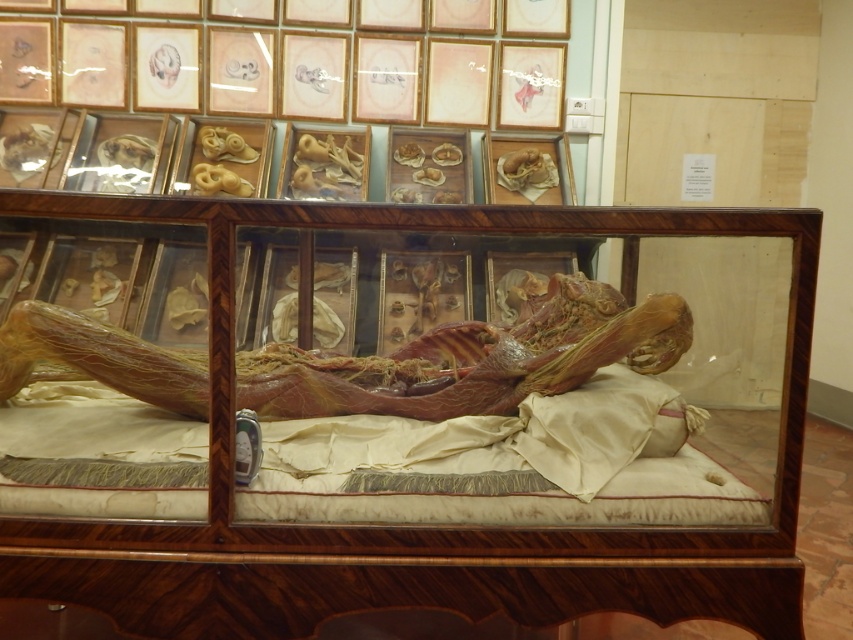
You are a museum visitor observing the transparent wood glass box at center and the translucent flesh at center in the display case. Which object takes up more space in the display case?

The transparent wood glass box at center has a larger size compared to the translucent flesh at center, so it takes up more space in the display case.

You are standing in front of the display case and want to know which of the two points, point (222, 609) or point (308, 387), is closer to you. Which one is it?

Point (222, 609) is closer to the camera than point (308, 387), so it is closer to you.

You are a visitor at a medical exhibition and notice the transparent wood glass box at center and the translucent flesh at center in the display. Which object is closer to you?

The transparent wood glass box at center is closer to you because it is in front of the translucent flesh at center.